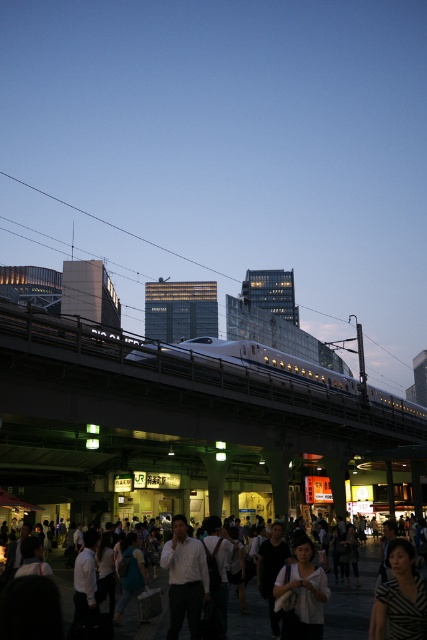
Question: Does dark gray clothing at lower center have a greater width compared to striped fabric shirt at lower right?

Choices:
 (A) no
 (B) yes

Answer: (B)

Question: Which point appears farthest from the camera in this image?

Choices:
 (A) (204, 556)
 (B) (321, 568)
 (C) (374, 620)

Answer: (B)

Question: Does metallic silver train at center come in front of dark gray clothing at lower center?

Choices:
 (A) no
 (B) yes

Answer: (A)

Question: Does striped fabric shirt at lower right appear on the left side of white shirt at center?

Choices:
 (A) no
 (B) yes

Answer: (A)

Question: Among these objects, which one is nearest to the camera?

Choices:
 (A) white matte shirt at lower center
 (B) striped fabric shirt at lower right
 (C) dark gray clothing at lower center
 (D) metallic silver train at center

Answer: (B)

Question: Among these objects, which one is nearest to the camera?

Choices:
 (A) white shirt at center
 (B) metallic silver train at center
 (C) white matte shirt at lower center

Answer: (C)